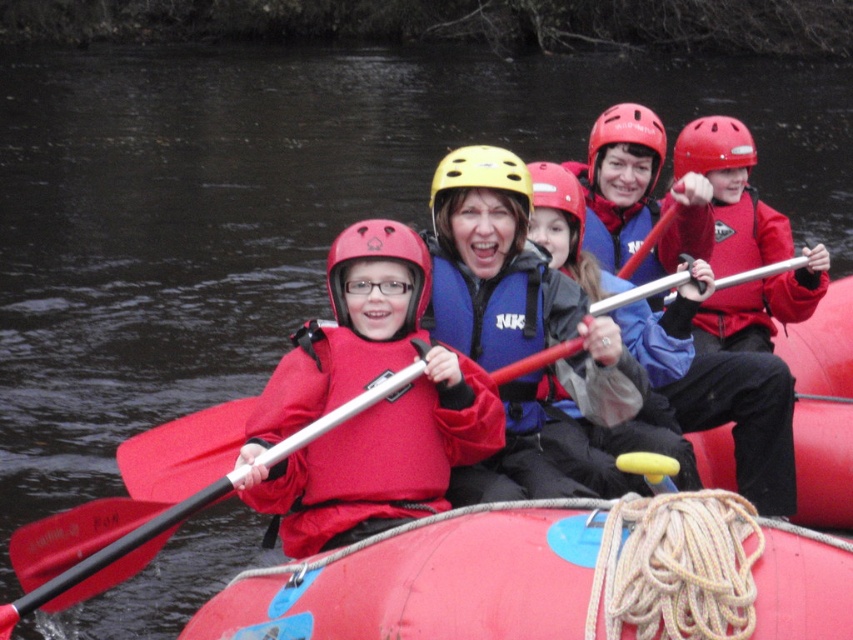
Is red matte life jacket at right positioned behind red matte helmet at center?

That is False.

Is red matte life jacket at right to the right of red matte helmet at center from the viewer's perspective?

Incorrect, red matte life jacket at right is not on the right side of red matte helmet at center.

Between point (721, 244) and point (589, 140), which one is positioned in front?

Positioned in front is point (721, 244).

You are a GUI agent. You are given a task and a screenshot of the screen. Output one action in this format:
    pyautogui.click(x=<x>, y=<y>)
    Task: Click on the red matte life jacket at right
    The image size is (853, 640).
    Given the screenshot: What is the action you would take?
    pyautogui.click(x=761, y=304)

Who is more distant from viewer, (839,449) or (683,152)?

The point (683,152) is behind.

Which is above, red rubber raft at center or red matte helmet at upper right?

Positioned higher is red matte helmet at upper right.

Who is more forward, (x=846, y=513) or (x=688, y=170)?

Point (x=846, y=513)

Locate an element on the screen. The width and height of the screenshot is (853, 640). red rubber raft at center is located at coordinates (430, 580).

Where is `red rubber raft at center`? red rubber raft at center is located at coordinates coord(430,580).

Does red rubber raft at center lie in front of blue nylon life vest at center?

Yes, red rubber raft at center is closer to the viewer.

This screenshot has width=853, height=640. Describe the element at coordinates (430, 580) in the screenshot. I see `red rubber raft at center` at that location.

I want to click on red rubber raft at center, so click(x=430, y=580).